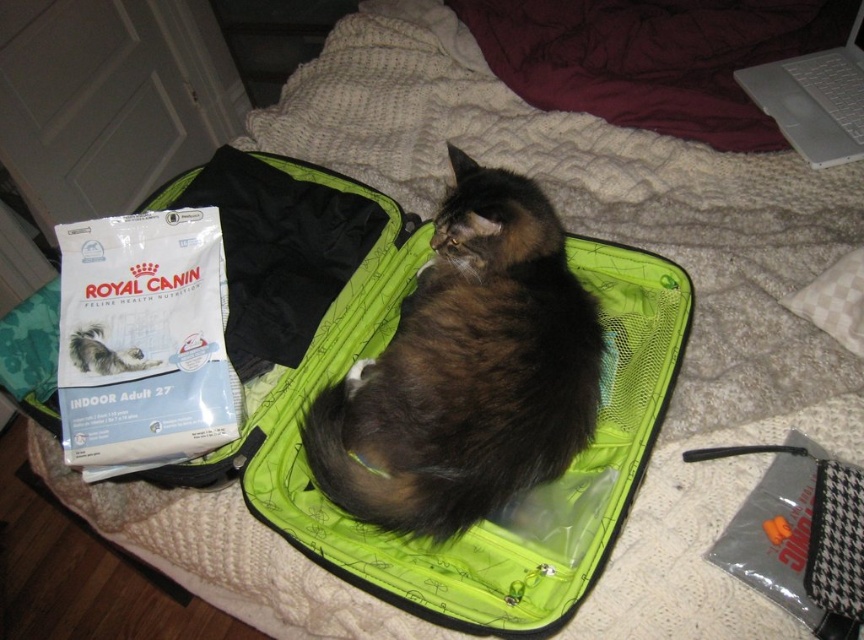
Is brown fluffy cat at center bigger than white plastic laptop at upper right?

Yes, brown fluffy cat at center is bigger than white plastic laptop at upper right.

Who is positioned more to the left, brown fluffy cat at center or white plastic laptop at upper right?

From the viewer's perspective, brown fluffy cat at center appears more on the left side.

Which is in front, point (509, 410) or point (855, 145)?

Point (509, 410) is more forward.

This screenshot has height=640, width=864. Find the location of `brown fluffy cat at center`. brown fluffy cat at center is located at coordinates (467, 371).